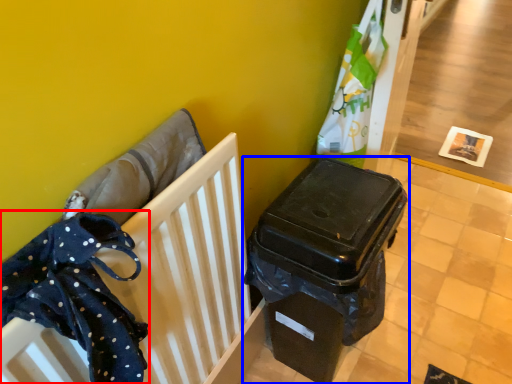
Question: Which object appears farthest to the camera in this image, clothe (highlighted by a red box) or waste container (highlighted by a blue box)?

Choices:
 (A) clothe
 (B) waste container

Answer: (B)